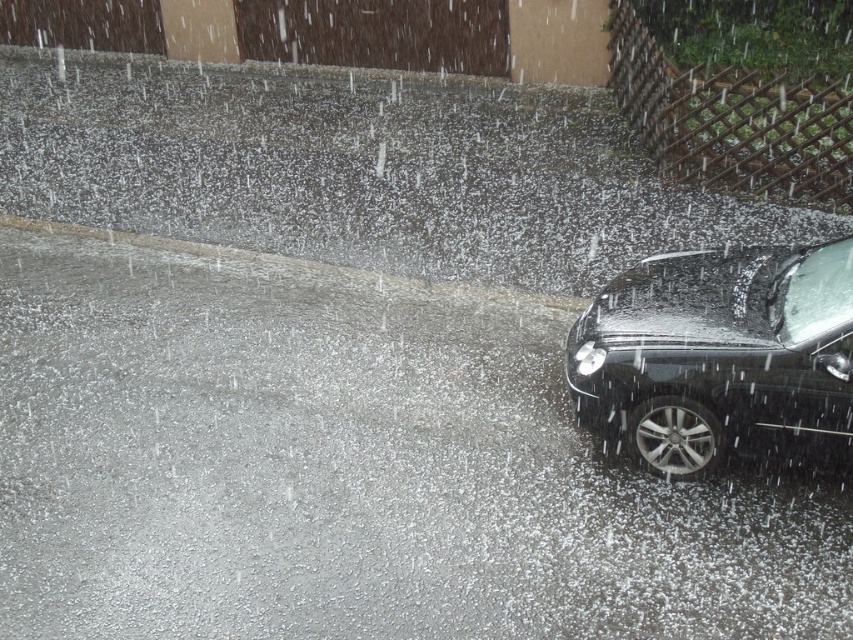
From the picture: Does glossy black car at right appear over gray concrete curb at lower left?

No.

Between glossy black car at right and gray concrete curb at lower left, which one appears on the right side from the viewer's perspective?

From the viewer's perspective, glossy black car at right appears more on the right side.

Is point (828, 468) closer to camera compared to point (183, 253)?

Yes, it is in front of point (183, 253).

Locate an element on the screen. Image resolution: width=853 pixels, height=640 pixels. glossy black car at right is located at coordinates (721, 356).